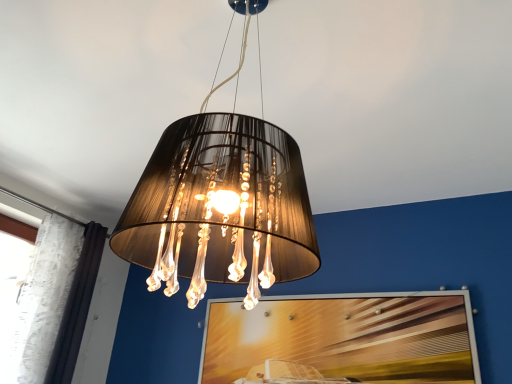
The image size is (512, 384). Describe the element at coordinates (342, 339) in the screenshot. I see `wooden textured picture frame at center` at that location.

Find the location of `white lace curtain at left`. white lace curtain at left is located at coordinates (46, 295).

Which object is closer to the camera taking this photo, wooden textured picture frame at center or matte black lampshade at center?

matte black lampshade at center is in front.

Considering the sizes of objects wooden textured picture frame at center and matte black lampshade at center in the image provided, who is bigger, wooden textured picture frame at center or matte black lampshade at center?

With larger size is matte black lampshade at center.

Considering the points (276, 310) and (144, 192), which point is behind, point (276, 310) or point (144, 192)?

The point (276, 310) is behind.

Which object is positioned more to the left, wooden textured picture frame at center or white lace curtain at left?

Positioned to the left is white lace curtain at left.

Where is `curtain above the wooden textured picture frame at center (from the image's perspective)`? curtain above the wooden textured picture frame at center (from the image's perspective) is located at coordinates (46, 295).

Does point (443, 356) appear closer or farther from the camera than point (28, 349)?

Point (443, 356) is closer to the camera than point (28, 349).

Is wooden textured picture frame at center touching white lace curtain at left?

There is a gap between wooden textured picture frame at center and white lace curtain at left.

You are a GUI agent. You are given a task and a screenshot of the screen. Output one action in this format:
    pyautogui.click(x=<x>, y=<y>)
    Task: Click on the lamp in front of the white lace curtain at left
    This screenshot has width=512, height=384.
    Given the screenshot: What is the action you would take?
    pyautogui.click(x=220, y=208)

From the image's perspective, does matte black lampshade at center appear higher than white lace curtain at left?

Yes, from the image's perspective, matte black lampshade at center is above white lace curtain at left.

Between matte black lampshade at center and white lace curtain at left, which one appears on the right side from the viewer's perspective?

Positioned to the right is matte black lampshade at center.

Which of these two, white lace curtain at left or wooden textured picture frame at center, is thinner?

wooden textured picture frame at center is thinner.

Is white lace curtain at left not near wooden textured picture frame at center?

Yes.

Between white lace curtain at left and wooden textured picture frame at center, which one is positioned in front?

wooden textured picture frame at center.

Who is shorter, white lace curtain at left or wooden textured picture frame at center?

wooden textured picture frame at center.

Is white lace curtain at left far away from matte black lampshade at center?

white lace curtain at left is far away from matte black lampshade at center.

Could you tell me if white lace curtain at left is turned towards matte black lampshade at center?

Answer: No.

From the image's perspective, is white lace curtain at left on top of matte black lampshade at center?

Incorrect, from the image's perspective, white lace curtain at left is lower than matte black lampshade at center.

Is matte black lampshade at center outside of wooden textured picture frame at center?

Yes.

Which is less distant, [260,160] or [367,336]?

The point [260,160] is more forward.

The width and height of the screenshot is (512, 384). In order to click on lamp on the left of wooden textured picture frame at center in this screenshot , I will do `click(220, 208)`.

Considering the positions of objects matte black lampshade at center and wooden textured picture frame at center in the image provided, who is behind, matte black lampshade at center or wooden textured picture frame at center?

Positioned behind is wooden textured picture frame at center.

The height and width of the screenshot is (384, 512). In order to click on lamp that appears in front of the wooden textured picture frame at center in this screenshot , I will do `click(220, 208)`.

Find the location of a particular element. The width and height of the screenshot is (512, 384). curtain above the wooden textured picture frame at center (from a real-world perspective) is located at coordinates [x=46, y=295].

Looking at the image, which one is located further to matte black lampshade at center, wooden textured picture frame at center or white lace curtain at left?

white lace curtain at left lies further to matte black lampshade at center than the other object.

Considering their positions, is matte black lampshade at center positioned further to white lace curtain at left than wooden textured picture frame at center?

matte black lampshade at center is further to white lace curtain at left.

Estimate the real-world distances between objects in this image. Which object is closer to wooden textured picture frame at center, white lace curtain at left or matte black lampshade at center?

white lace curtain at left is positioned closer to the anchor wooden textured picture frame at center.

In the scene shown: Estimate the real-world distances between objects in this image. Which object is further from white lace curtain at left, wooden textured picture frame at center or matte black lampshade at center?

matte black lampshade at center is further to white lace curtain at left.

When comparing their distances from wooden textured picture frame at center, does matte black lampshade at center or white lace curtain at left seem further?

matte black lampshade at center is further to wooden textured picture frame at center.

Considering their positions, is white lace curtain at left positioned further to matte black lampshade at center than wooden textured picture frame at center?

white lace curtain at left.

Where is `lamp between white lace curtain at left and wooden textured picture frame at center in the horizontal direction`? This screenshot has width=512, height=384. lamp between white lace curtain at left and wooden textured picture frame at center in the horizontal direction is located at coordinates (220, 208).